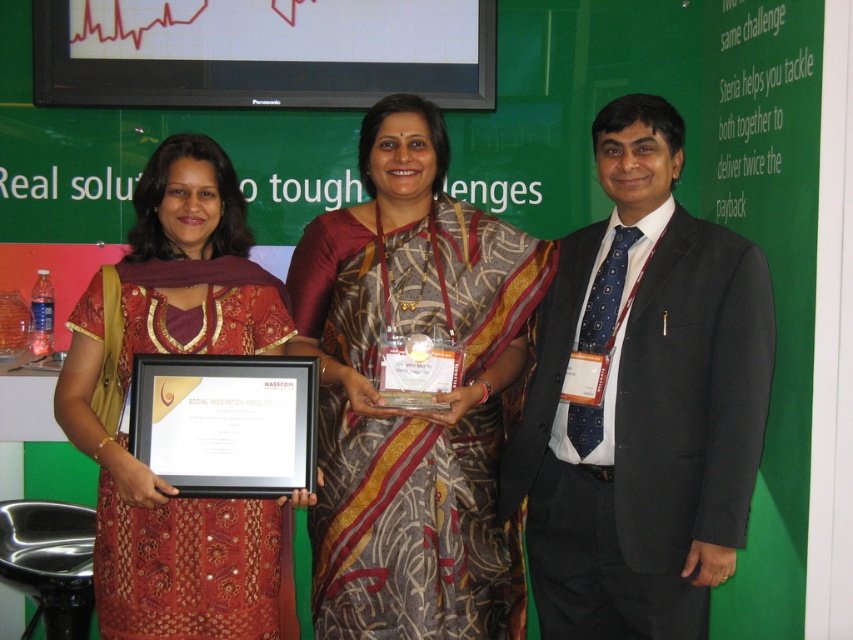
Question: Which object is positioned closest to the printed silk saree at center?

Choices:
 (A) black suit at right
 (B) matte red dress at center

Answer: (A)

Question: Can you confirm if printed silk saree at center is smaller than matte red dress at center?

Choices:
 (A) no
 (B) yes

Answer: (B)

Question: Is black suit at right to the right of printed silk saree at center from the viewer's perspective?

Choices:
 (A) yes
 (B) no

Answer: (A)

Question: Estimate the real-world distances between objects in this image. Which object is farther from the matte red dress at center?

Choices:
 (A) printed silk saree at center
 (B) black suit at right

Answer: (B)

Question: Where is black suit at right located in relation to matte red dress at center in the image?

Choices:
 (A) below
 (B) above

Answer: (B)

Question: Estimate the real-world distances between objects in this image. Which object is closer to the black suit at right?

Choices:
 (A) printed silk saree at center
 (B) matte red dress at center

Answer: (A)